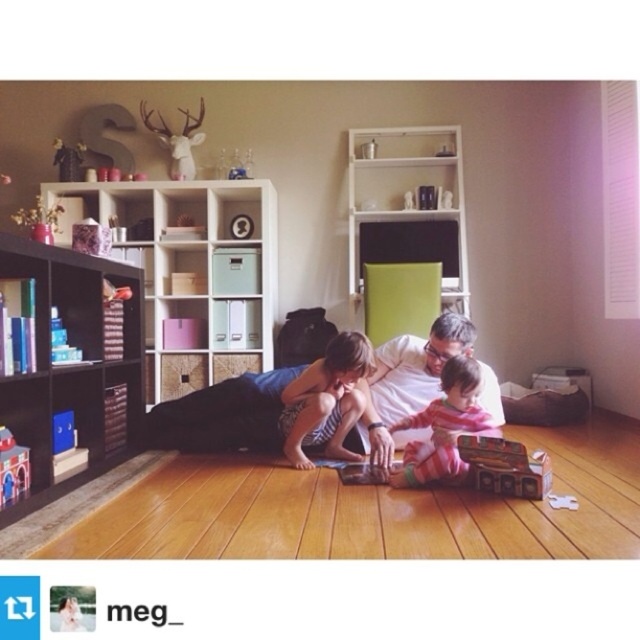
How distant is striped cotton shirt at center from matte blue toy at left?

striped cotton shirt at center and matte blue toy at left are 5.36 feet apart.

Is striped cotton shirt at center positioned in front of matte blue toy at left?

No, it is not.

Identify the location of striped cotton shirt at center. (444, 426).

Is white cotton shirt at center taller than red plastic toy at lower left?

Indeed, white cotton shirt at center has a greater height compared to red plastic toy at lower left.

Can you confirm if white cotton shirt at center is positioned below red plastic toy at lower left?

No, white cotton shirt at center is not below red plastic toy at lower left.

You are a GUI agent. You are given a task and a screenshot of the screen. Output one action in this format:
    pyautogui.click(x=<x>, y=<y>)
    Task: Click on the white cotton shirt at center
    The width and height of the screenshot is (640, 640).
    Given the screenshot: What is the action you would take?
    pyautogui.click(x=404, y=385)

Locate an element on the screen. The image size is (640, 640). white cotton shirt at center is located at coordinates (404, 385).

Does red plastic toy at lower left have a lesser width compared to wooden toy at upper left?

Correct, red plastic toy at lower left's width is less than wooden toy at upper left's.

Which is more to the right, red plastic toy at lower left or wooden toy at upper left?

From the viewer's perspective, red plastic toy at lower left appears more on the right side.

Is point (22, 496) less distant than point (35, 237)?

Yes.

The height and width of the screenshot is (640, 640). I want to click on red plastic toy at lower left, so click(x=12, y=468).